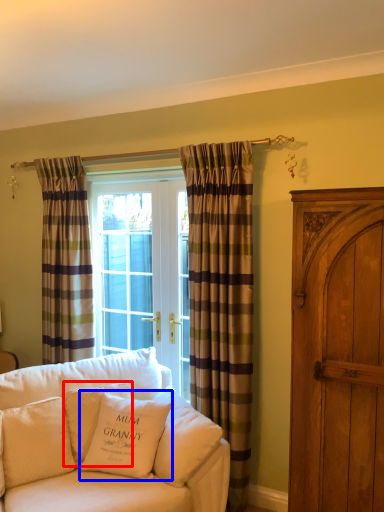
Question: Which object appears farthest to the camera in this image, pillow (highlighted by a red box) or pillow (highlighted by a blue box)?

Choices:
 (A) pillow
 (B) pillow

Answer: (A)